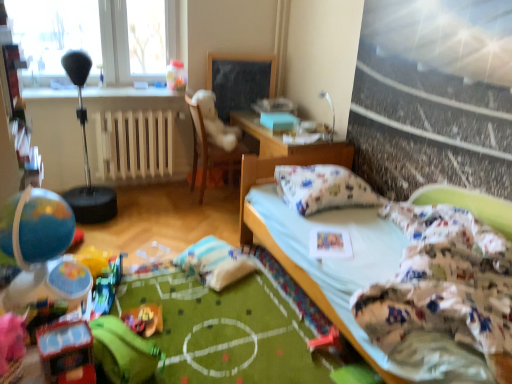
The height and width of the screenshot is (384, 512). I want to click on empty space that is ontop of plush yellow bear at center, which is counted as the second toy, starting from the back (from a real-world perspective), so click(x=143, y=314).